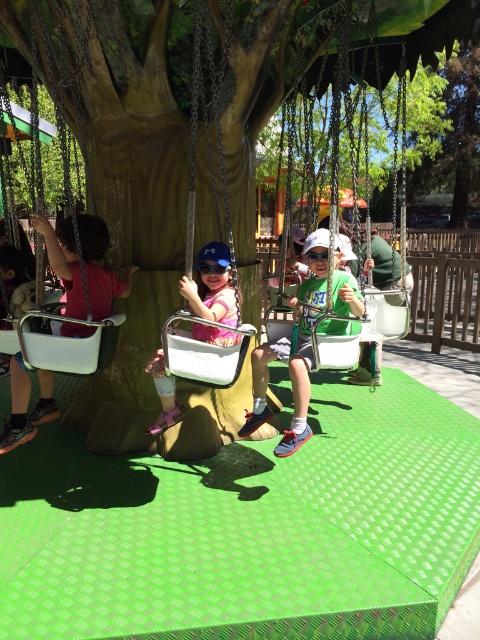
Is green matte shirt at center to the left of matte pink shirt at center from the viewer's perspective?

In fact, green matte shirt at center is to the right of matte pink shirt at center.

Describe the element at coordinates (300, 387) in the screenshot. The height and width of the screenshot is (640, 480). I see `green matte shirt at center` at that location.

Locate an element on the screen. This screenshot has height=640, width=480. green matte shirt at center is located at coordinates (300, 387).

Who is higher up, white plastic swing at center or blue reflective goggles at center?

white plastic swing at center is above.

Is white plastic swing at center below blue reflective goggles at center?

Incorrect, white plastic swing at center is not positioned below blue reflective goggles at center.

I want to click on white plastic swing at center, so click(x=225, y=248).

Which is above, matte white swing at left or blue reflective goggles at center?

Positioned higher is blue reflective goggles at center.

Is point (73, 262) closer to camera compared to point (216, 264)?

No, (73, 262) is behind (216, 264).

Who is more forward, (72, 308) or (208, 264)?

Point (208, 264)

Where is `matte white swing at left`? This screenshot has height=640, width=480. matte white swing at left is located at coordinates (99, 266).